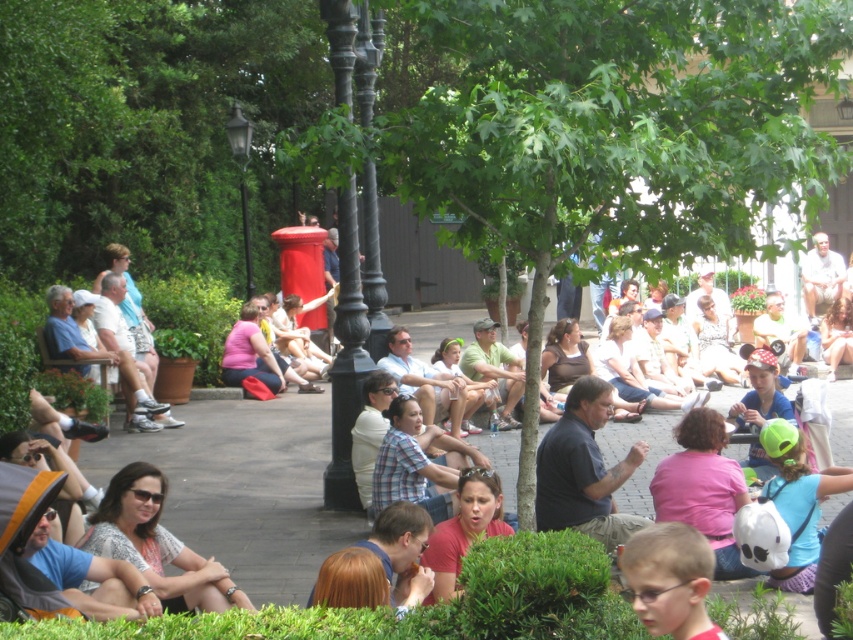
You are standing in the park and want to take a photo of the green leafy tree at center. Your camera has a maximum focus range of 5 meters. Will the camera be able to focus on the tree?

The distance between you and the green leafy tree at center is 5.63 meters, which exceeds the camera maximum focus range of 5 meters. Therefore, the camera cannot focus on the tree.